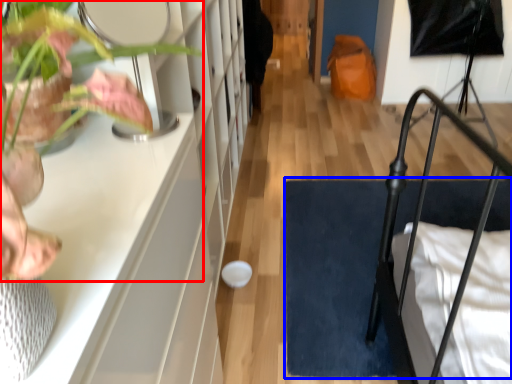
Question: Which point is closer to the camera, houseplant (highlighted by a red box) or doormat (highlighted by a blue box)?

Choices:
 (A) houseplant
 (B) doormat

Answer: (A)